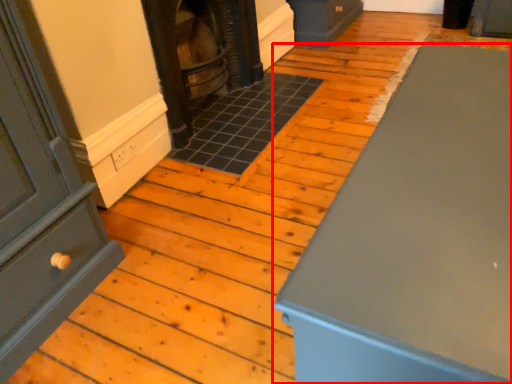
Question: From the image's perspective, what is the correct spatial relationship of furniture (annotated by the red box) in relation to stove?

Choices:
 (A) below
 (B) above

Answer: (A)